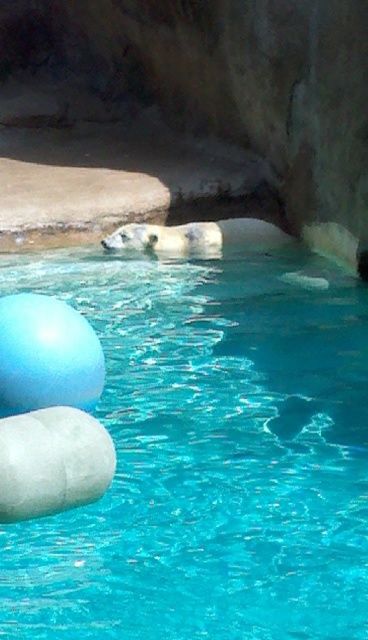
Question: Which object is closer to the camera taking this photo?

Choices:
 (A) white fur polar bear at center
 (B) transparent blue water at upper center

Answer: (B)

Question: Which point is farther to the camera?

Choices:
 (A) (238, 236)
 (B) (358, 333)

Answer: (A)

Question: Is transparent blue water at upper center positioned in front of white fur polar bear at center?

Choices:
 (A) yes
 (B) no

Answer: (A)

Question: Does transparent blue water at upper center appear on the right side of white fur polar bear at center?

Choices:
 (A) yes
 (B) no

Answer: (B)

Question: Which point is closer to the camera?

Choices:
 (A) transparent blue water at upper center
 (B) white fur polar bear at center

Answer: (A)

Question: Can you confirm if transparent blue water at upper center is bigger than white fur polar bear at center?

Choices:
 (A) yes
 (B) no

Answer: (B)